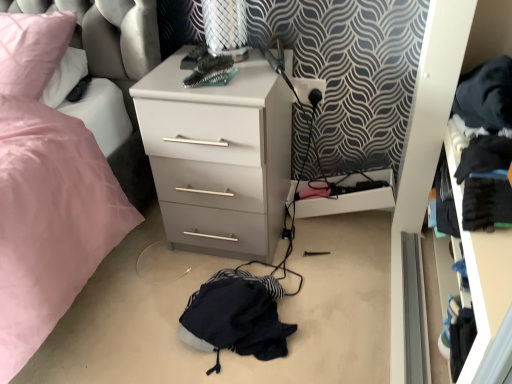
Image resolution: width=512 pixels, height=384 pixels. Identify the location of free location in front of white plastic drawer at lower center. (345, 258).